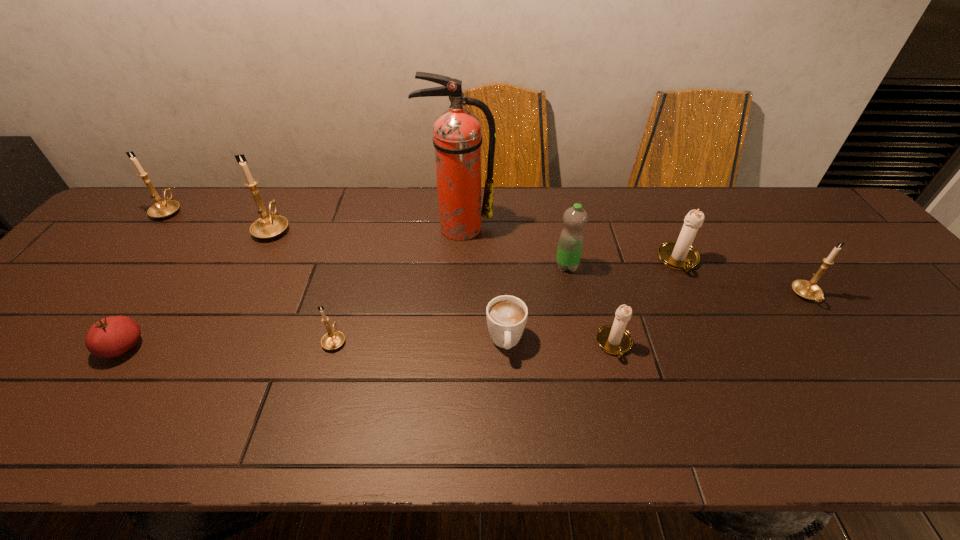
Where is `vacant space located 0.050m on the handle side of the second gold candle holder from left to right`? The width and height of the screenshot is (960, 540). vacant space located 0.050m on the handle side of the second gold candle holder from left to right is located at coordinates (285, 205).

This screenshot has height=540, width=960. I want to click on free region located on the handle side of the second biggest gold candle holder, so 184,191.

At what (x,y) coordinates should I click in order to perform the action: click on vacant position located on the back of the fourth object from right to left. Please return your answer as a coordinate pair (x, y). Looking at the image, I should click on coord(561,235).

I want to click on vacant space located on the handle side of the rightmost gold candle holder, so click(888, 410).

The image size is (960, 540). Find the location of `vacant area situated 0.230m on the handle side of the right white candle holder`. vacant area situated 0.230m on the handle side of the right white candle holder is located at coordinates click(720, 349).

Identify the location of vacant position located 0.330m on the handle side of the smallest gold candle holder. (364, 239).

I want to click on free space located on the handle side of the smallest gold candle holder, so click(x=358, y=260).

Find the location of a particular element. The image size is (960, 540). free space located 0.090m on the handle side of the smallest gold candle holder is located at coordinates (347, 300).

The image size is (960, 540). Find the location of `vacant position located 0.120m on the handle side of the smaller white candle holder`. vacant position located 0.120m on the handle side of the smaller white candle holder is located at coordinates (633, 413).

Locate an element on the screen. The height and width of the screenshot is (540, 960). vacant space located on the back of the ninth object from right to left is located at coordinates pos(149,310).